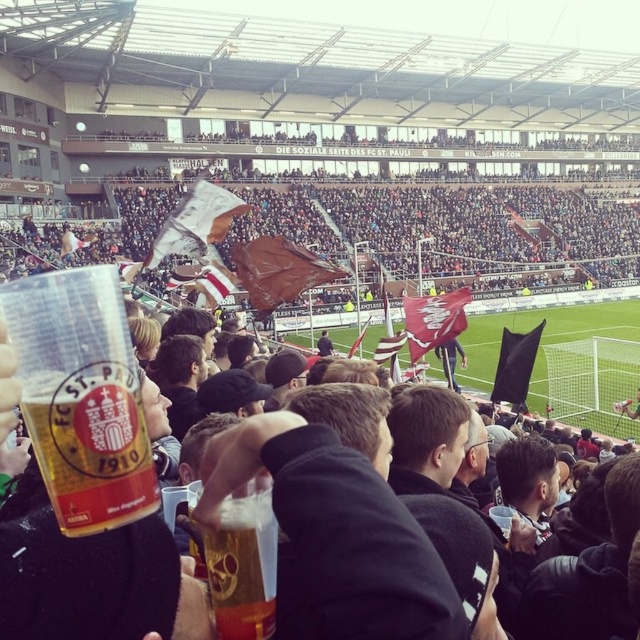
Question: Which of the following is the farthest from the observer?

Choices:
 (A) (276, 438)
 (B) (458, 275)

Answer: (B)

Question: Can you confirm if black fabric jacket at center is positioned to the left of brown fabric flags at upper center?

Choices:
 (A) no
 (B) yes

Answer: (B)

Question: Does black fabric jacket at center appear under translucent plastic cup at center?

Choices:
 (A) no
 (B) yes

Answer: (A)

Question: Estimate the real-world distances between objects in this image. Which object is closer to the green grass football field at center?

Choices:
 (A) black fabric jacket at center
 (B) brown fabric flags at upper center
 (C) translucent plastic cup at center

Answer: (B)

Question: Among these objects, which one is nearest to the camera?

Choices:
 (A) green grass football field at center
 (B) brown fabric flags at upper center
 (C) black fabric jacket at center

Answer: (C)

Question: Is black fabric jacket at center behind green grass football field at center?

Choices:
 (A) yes
 (B) no

Answer: (B)